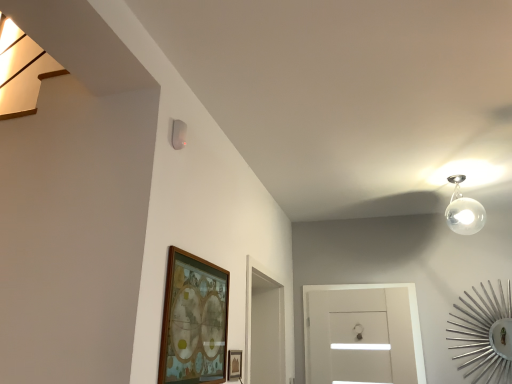
Question: Is wooden framed artwork at lower center, which appears as the 2th picture frame when viewed from the right, to the left or to the right of wooden picture frame at lower center, the second picture frame when ordered from left to right, in the image?

Choices:
 (A) left
 (B) right

Answer: (A)

Question: In the image, is wooden framed artwork at lower center, which appears as the 2th picture frame when viewed from the right, positioned in front of or behind wooden picture frame at lower center, which ranks as the 1th picture frame in right-to-left order?

Choices:
 (A) front
 (B) behind

Answer: (A)

Question: Which is farther from the transparent glass door at center?

Choices:
 (A) wooden picture frame at lower center, the second picture frame when ordered from left to right
 (B) wooden framed artwork at lower center, which appears as the 2th picture frame when viewed from the right

Answer: (B)

Question: Estimate the real-world distances between objects in this image. Which object is farther from the wooden framed artwork at lower center, the first picture frame when ordered from left to right?

Choices:
 (A) transparent glass door at center
 (B) wooden picture frame at lower center, the second picture frame when ordered from left to right

Answer: (A)